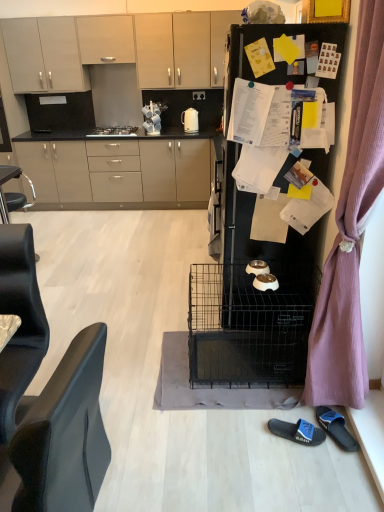
Question: Relative to matte gray cabinets at upper left, placed as the third cabinetry when sorted from top to bottom, is matte beige cabinets at center, the first cabinetry positioned from the bottom, in front or behind?

Choices:
 (A) front
 (B) behind

Answer: (B)

Question: Is matte beige cabinets at center, which is the 4th cabinetry from top to bottom, taller or shorter than matte gray cabinets at upper left, placed as the second cabinetry when sorted from bottom to top?

Choices:
 (A) tall
 (B) short

Answer: (A)

Question: Considering the real-world distances, which object is farthest from the satin silver gas stove at upper center?

Choices:
 (A) blue rubber slipper at lower right, arranged as the second footwear when viewed from the left
 (B) beige matte cabinet at upper center, the third cabinetry from the bottom
 (C) matte beige cabinets at center, which is the 4th cabinetry from top to bottom
 (D) black leather armchair at left
 (E) white glossy coffee cup at upper center

Answer: (A)

Question: Estimate the real-world distances between objects in this image. Which object is farther from the black leather armchair at left?

Choices:
 (A) white glossy coffee cup at upper center
 (B) beige matte cabinet at upper center, the second cabinetry viewed from the top
 (C) white glossy electric kettle at upper center
 (D) matte beige cabinets at center, the first cabinetry positioned from the bottom
 (E) matte white cabinet at upper center, positioned as the first cabinetry in top-to-bottom order

Answer: (B)